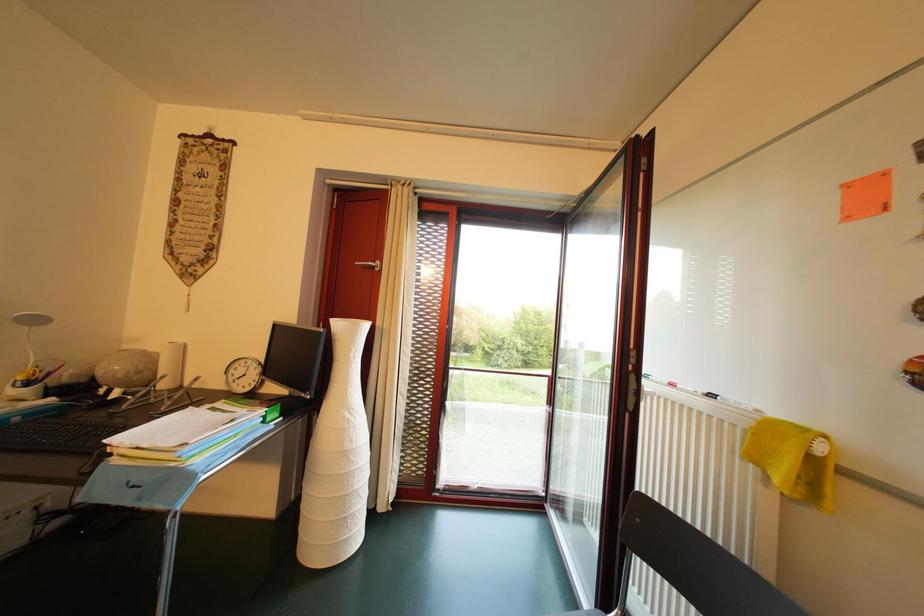
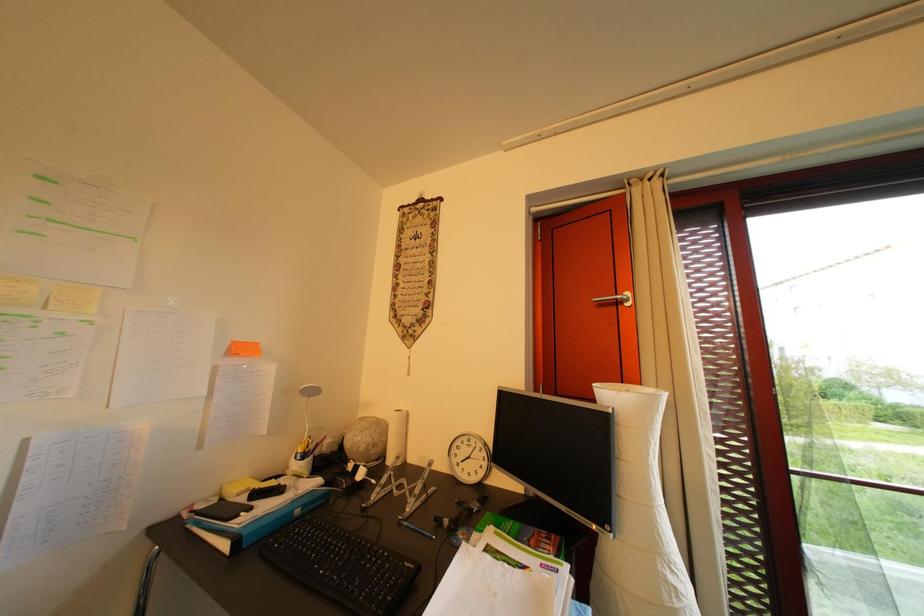
What movement of the cameraman would produce the second image?

The cameraman moved toward left, forward.